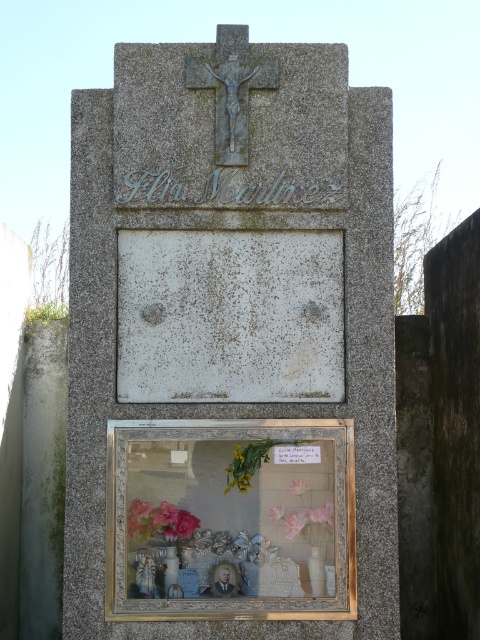
You are standing in front of the tombstone and want to place a flower at the point closer to you between point [160,525] and point [269,516]. Which point should you choose?

Point [160,525] is in front of point [269,516], so you should choose point [160,525] as it is closer to you.

You are a florist who wants to place two pink flowers on the tombstone of Flia Martinez. You have a pink fabric flower at center and a pink matte flower at lower center. Which flower should you place higher up on the tombstone to match its current decoration?

The pink fabric flower at center is larger in size than the pink matte flower at lower center, so to match the current decoration, you should place the larger pink fabric flower at center higher up on the tombstone.

You are standing in front of the tombstone and want to place a pink matte flower at lower center. Considering the granite cross at upper center, will the flower be visible from below the cross?

The granite cross at upper center is much taller than the pink matte flower at lower center, so yes, the flower will be visible from below the cross since it is positioned lower and the cross does not block its view.